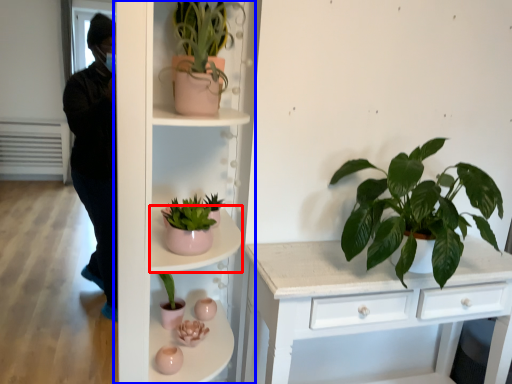
Question: Which of the following is the farthest to the observer, shelf (highlighted by a red box) or shelf (highlighted by a blue box)?

Choices:
 (A) shelf
 (B) shelf

Answer: (A)